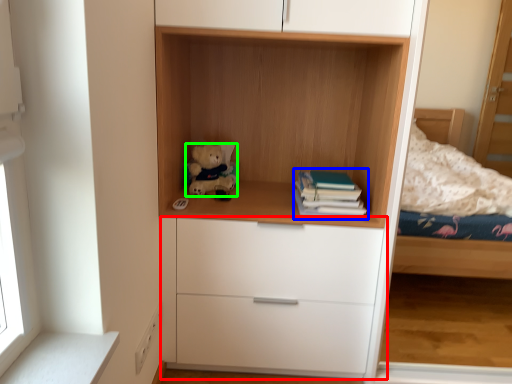
Question: Which is nearer to the chest of drawers (highlighted by a red box)? paperback book (highlighted by a blue box) or teddy bear (highlighted by a green box).

Choices:
 (A) paperback book
 (B) teddy bear

Answer: (A)